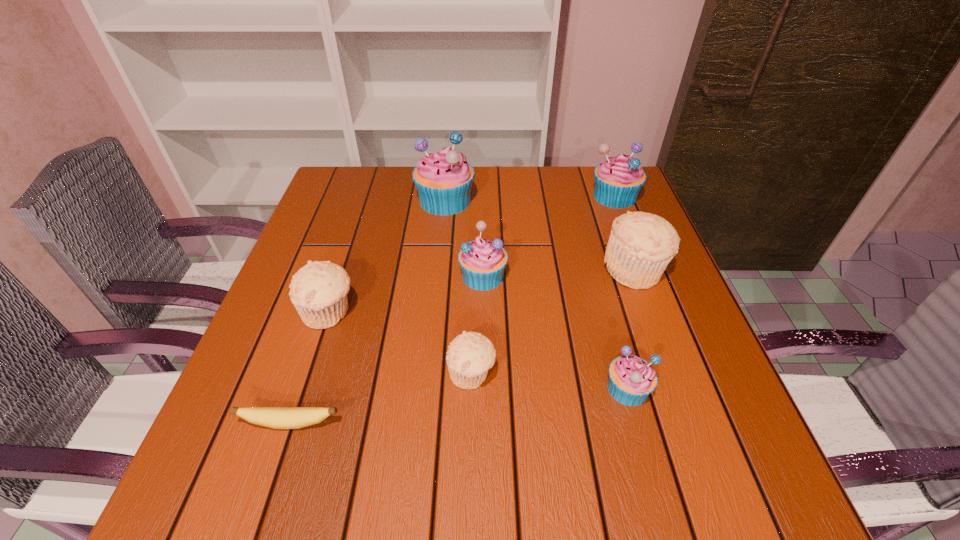
Locate an element on the screen. This screenshot has height=540, width=960. blank region between the leftmost muffin and the nearest beige muffin is located at coordinates (400, 342).

Locate an element on the screen. empty space that is in between the second nearest blue muffin and the tallest object is located at coordinates (464, 238).

This screenshot has width=960, height=540. Identify the location of vacant area that lies between the tallest object and the second smallest beige muffin. (387, 256).

Find the location of a particular element. The image size is (960, 540). free space between the biggest blue muffin and the smallest blue muffin is located at coordinates (537, 294).

Identify the location of unoccupied position between the nearest beige muffin and the second biggest blue muffin. (543, 285).

Identify the location of vacant area between the shortest object and the nearest beige muffin. The height and width of the screenshot is (540, 960). (381, 399).

At what (x,y) coordinates should I click in order to perform the action: click on unoccupied area between the third farthest blue muffin and the smallest blue muffin. Please return your answer as a coordinate pair (x, y). The width and height of the screenshot is (960, 540). Looking at the image, I should click on (555, 332).

Where is `blank region between the third farthest blue muffin and the smallest blue muffin`? The image size is (960, 540). blank region between the third farthest blue muffin and the smallest blue muffin is located at coordinates (555, 332).

Identify which object is the nearest to the leftmost muffin. Please provide its 2D coordinates. Your answer should be formatted as a tuple, i.e. [(x, y)], where the tuple contains the x and y coordinates of a point satisfying the conditions above.

[(274, 417)]

Find the location of a particular element. The height and width of the screenshot is (540, 960). object that is the fifth closest one to the second biggest blue muffin is located at coordinates (470, 355).